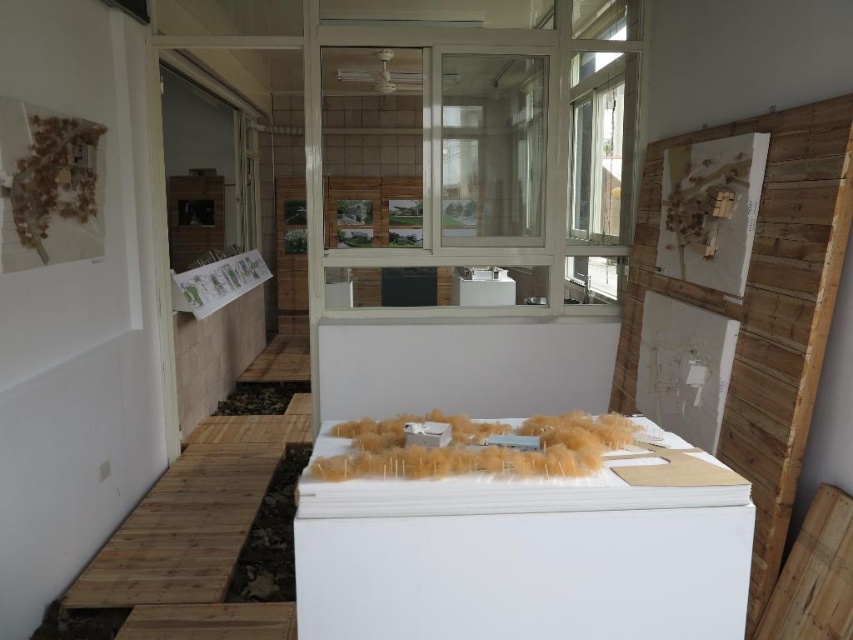
You are an interior designer who needs to move a new sofa into the room. The sofa is 7 feet long. You see the white foam model at center and the white glossy refrigerator at center. Can the sofa fit between them without being moved?

The white foam model at center and the white glossy refrigerator at center are 7.49 feet apart from each other. Since the sofa is 7 feet long, it can fit between them as the distance is slightly more than the sofa length.

You are an interior designer inspecting a construction site. You notice the white foam model at center and the white glossy refrigerator at center. Which object is bigger?

The white foam model at center is larger in size than the white glossy refrigerator at center.